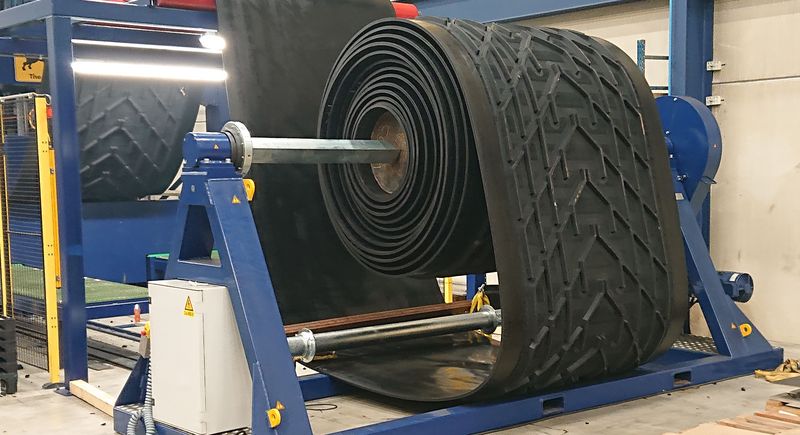
I want to click on smooth side of the mat, so click(x=272, y=43), click(x=306, y=243), click(x=370, y=285).